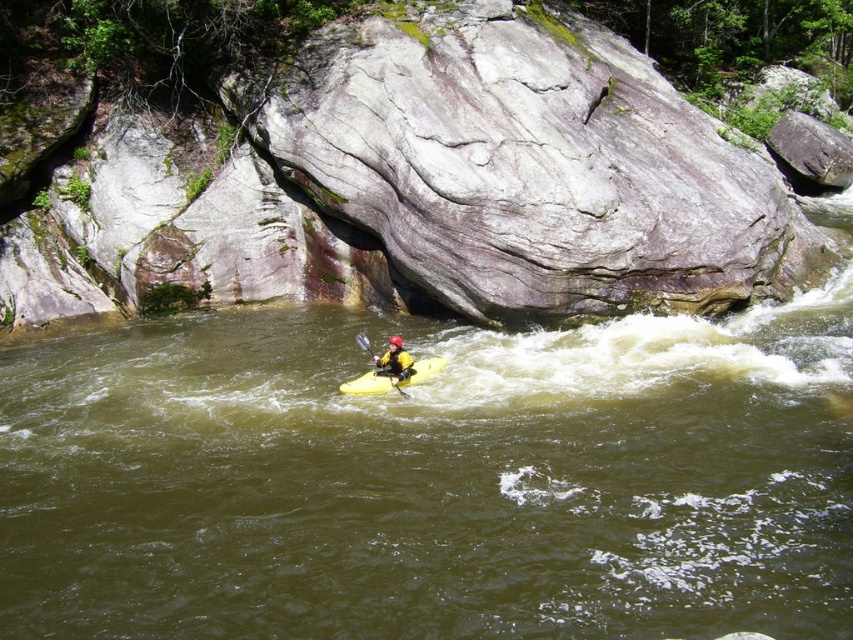
Describe the element at coordinates (431, 480) in the screenshot. I see `greenish-brown water at center` at that location.

Is the position of greenish-brown water at center less distant than that of yellow rubber kayak at center?

Yes, greenish-brown water at center is in front of yellow rubber kayak at center.

At what (x,y) coordinates should I click in order to perform the action: click on greenish-brown water at center. Please return your answer as a coordinate pair (x, y). Looking at the image, I should click on point(431,480).

Does gray rough rock at center lie in front of yellow plastic paddle at center?

No, it is not.

Measure the distance from gray rough rock at center to yellow plastic paddle at center.

The distance of gray rough rock at center from yellow plastic paddle at center is 7.03 meters.

You are a GUI agent. You are given a task and a screenshot of the screen. Output one action in this format:
    pyautogui.click(x=<x>, y=<y>)
    Task: Click on the gray rough rock at center
    Image resolution: width=853 pixels, height=640 pixels.
    Given the screenshot: What is the action you would take?
    pyautogui.click(x=422, y=188)

This screenshot has height=640, width=853. What are the coordinates of `gray rough rock at center` in the screenshot? It's located at (422, 188).

Consider the image. Is yellow matte kayak at center to the left of yellow rubber kayak at center from the viewer's perspective?

Incorrect, yellow matte kayak at center is not on the left side of yellow rubber kayak at center.

Locate an element on the screen. The height and width of the screenshot is (640, 853). yellow matte kayak at center is located at coordinates pos(393,378).

Find the location of a particular element. yellow matte kayak at center is located at coordinates (393, 378).